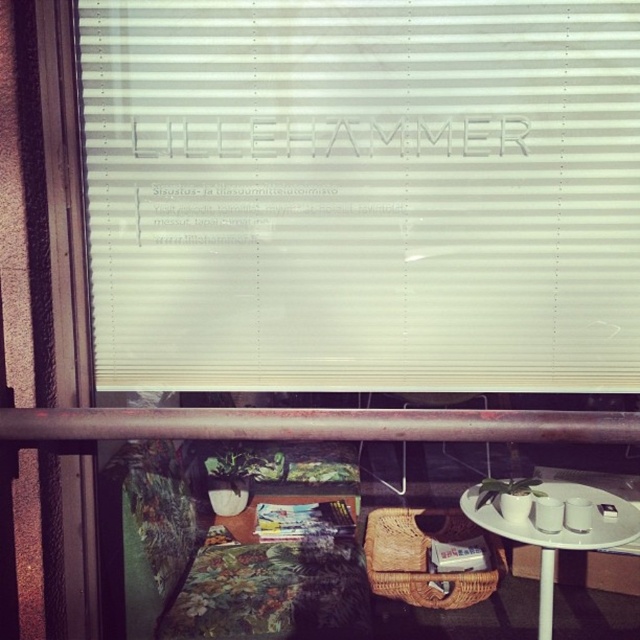
From the picture: Is white matte blinds at center to the right of rusty metal rail at lower center from the viewer's perspective?

Correct, you'll find white matte blinds at center to the right of rusty metal rail at lower center.

Measure the distance between white matte blinds at center and camera.

white matte blinds at center is 5.31 feet from camera.

This screenshot has height=640, width=640. Identify the location of white matte blinds at center. (364, 193).

Is rusty metal rail at lower center taller than white ceramic table at lower right?

No.

Between point (486, 410) and point (582, 492), which one is positioned behind?

Point (582, 492)

At what (x,y) coordinates should I click in order to perform the action: click on rusty metal rail at lower center. Please return your answer as a coordinate pair (x, y). Image resolution: width=640 pixels, height=640 pixels. Looking at the image, I should click on [317, 424].

How far apart are white matte blinds at center and white ceramic table at lower right?

white matte blinds at center and white ceramic table at lower right are 86.76 centimeters apart from each other.

Who is higher up, white matte blinds at center or white ceramic table at lower right?

Positioned higher is white matte blinds at center.

I want to click on white matte blinds at center, so click(364, 193).

The width and height of the screenshot is (640, 640). In order to click on white matte blinds at center in this screenshot , I will do `click(364, 193)`.